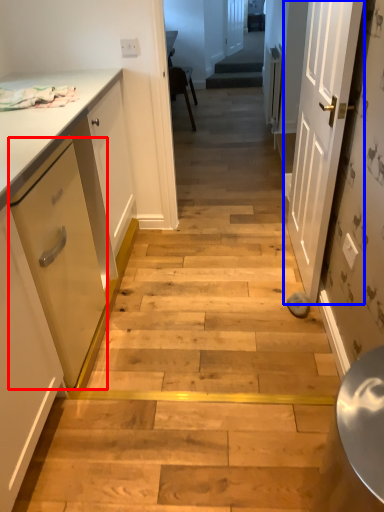
Question: Which object appears closest to the camera in this image, drawer (highlighted by a red box) or door (highlighted by a blue box)?

Choices:
 (A) drawer
 (B) door

Answer: (A)